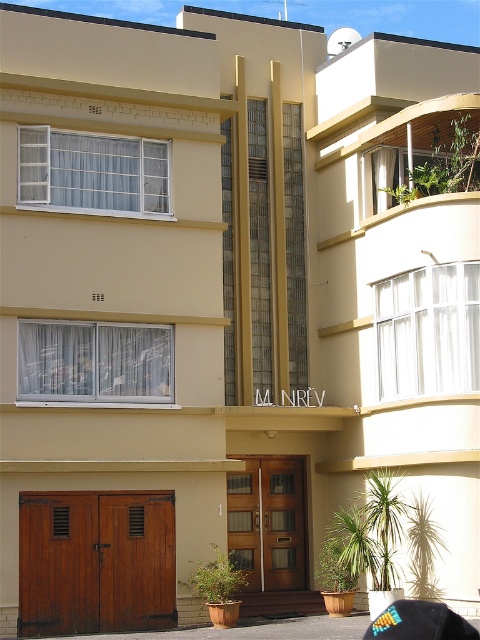
Question: Estimate the real-world distances between objects in this image. Which object is closer to the multicolored fabric baseball cap at lower right?

Choices:
 (A) brown wooden door at lower left
 (B) wooden at lower left

Answer: (A)

Question: Which point is farther to the camera?

Choices:
 (A) brown wooden door at lower left
 (B) wooden at lower left
 (C) multicolored fabric baseball cap at lower right

Answer: (A)

Question: Can you confirm if wooden at lower left is bigger than multicolored fabric baseball cap at lower right?

Choices:
 (A) no
 (B) yes

Answer: (A)

Question: Which point is closer to the camera taking this photo?

Choices:
 (A) (405, 618)
 (B) (254, 548)
 (C) (156, 627)

Answer: (A)

Question: From the image, what is the correct spatial relationship of wooden at lower left in relation to brown wooden door at lower left?

Choices:
 (A) left
 (B) right

Answer: (A)

Question: Is brown wooden door at lower left above multicolored fabric baseball cap at lower right?

Choices:
 (A) yes
 (B) no

Answer: (B)